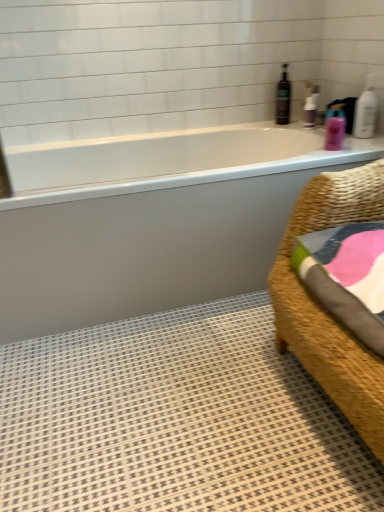
What do you see at coordinates (283, 98) in the screenshot? I see `brown glass bottle at upper right` at bounding box center [283, 98].

What is the approximate height of woven wicker chair at right?

It is 31.91 inches.

What do you see at coordinates (152, 221) in the screenshot? This screenshot has height=512, width=384. I see `white glossy bathtub at upper center` at bounding box center [152, 221].

Locate an element on the screen. The height and width of the screenshot is (512, 384). white glossy bathtub at upper center is located at coordinates (152, 221).

What do you see at coordinates (334, 133) in the screenshot? I see `pink glossy lotion at upper right, the 1th toiletry in the bottom-to-top sequence` at bounding box center [334, 133].

Identify the location of white textured bath mat at lower right. Image resolution: width=384 pixels, height=512 pixels. (176, 420).

Which object is closer to the camera, white glossy bathtub at upper center or woven wicker chair at right?

woven wicker chair at right is more forward.

Considering the positions of points (127, 264) and (271, 276), is point (127, 264) farther from camera compared to point (271, 276)?

Yes, point (127, 264) is behind point (271, 276).

From the image's perspective, is white glossy bathtub at upper center located above woven wicker chair at right?

Correct, white glossy bathtub at upper center appears higher than woven wicker chair at right in the image.

Are white plastic pump at upper right, placed as the 2th toiletry when sorted from bottom to top, and white glossy bathtub at upper center located far from each other?

No, white plastic pump at upper right, placed as the 2th toiletry when sorted from bottom to top, is not far away from white glossy bathtub at upper center.

Does white plastic pump at upper right, acting as the first toiletry starting from the back, come behind white glossy bathtub at upper center?

Yes, it is behind white glossy bathtub at upper center.

Find the location of a particular element. bathtub in front of the white plastic pump at upper right, placed as the 2th toiletry when sorted from bottom to top is located at coordinates (152, 221).

How far apart are white plastic pump at upper right, placed as the 2th toiletry when sorted from bottom to top, and white glossy bathtub at upper center?

white plastic pump at upper right, placed as the 2th toiletry when sorted from bottom to top, and white glossy bathtub at upper center are 35.32 inches apart.

Considering the relative sizes of woven wicker chair at right and white textured bath mat at lower right in the image provided, is woven wicker chair at right wider than white textured bath mat at lower right?

No, woven wicker chair at right is not wider than white textured bath mat at lower right.

Is woven wicker chair at right surrounding white textured bath mat at lower right?

Actually, white textured bath mat at lower right is outside woven wicker chair at right.

Can you tell me how much woven wicker chair at right and white textured bath mat at lower right differ in facing direction?

0.609 degrees separate the facing orientations of woven wicker chair at right and white textured bath mat at lower right.

Considering their positions, is woven wicker chair at right located in front of or behind white textured bath mat at lower right?

woven wicker chair at right is in front of white textured bath mat at lower right.

Is pink glossy lotion at upper right, the 2th toiletry positioned from the top, beside woven wicker chair at right?

No, pink glossy lotion at upper right, the 2th toiletry positioned from the top, is not in contact with woven wicker chair at right.

How far apart are pink glossy lotion at upper right, the first toiletry viewed from the front, and woven wicker chair at right?

pink glossy lotion at upper right, the first toiletry viewed from the front, and woven wicker chair at right are 37.53 inches apart.

The height and width of the screenshot is (512, 384). Identify the location of furniture lying on the left of pink glossy lotion at upper right, marked as the 2th toiletry in a back-to-front arrangement. (323, 307).

From the image's perspective, between pink glossy lotion at upper right, the 1th toiletry in the bottom-to-top sequence, and woven wicker chair at right, which one is located above?

pink glossy lotion at upper right, the 1th toiletry in the bottom-to-top sequence.

Does point (295, 313) come behind point (304, 116)?

No, (295, 313) is closer to viewer.

Can you confirm if woven wicker chair at right is shorter than white plastic pump at upper right, the 1th toiletry positioned from the top?

Incorrect, the height of woven wicker chair at right does not fall short of that of white plastic pump at upper right, the 1th toiletry positioned from the top.

Is woven wicker chair at right turned away from white plastic pump at upper right, acting as the first toiletry starting from the back?

No, woven wicker chair at right is not facing the opposite direction of white plastic pump at upper right, acting as the first toiletry starting from the back.

Can white plastic pump at upper right, acting as the first toiletry starting from the back, be found inside woven wicker chair at right?

That's incorrect, white plastic pump at upper right, acting as the first toiletry starting from the back, is not inside woven wicker chair at right.

How many degrees apart are the facing directions of white textured bath mat at lower right and woven wicker chair at right?

There is a 0.609-degree angle between the facing directions of white textured bath mat at lower right and woven wicker chair at right.

From the image's perspective, is white textured bath mat at lower right positioned above or below woven wicker chair at right?

Clearly, from the image's perspective, white textured bath mat at lower right is below woven wicker chair at right.

The image size is (384, 512). Find the location of `bath mat behind the woven wicker chair at right`. bath mat behind the woven wicker chair at right is located at coordinates (176, 420).

Relative to woven wicker chair at right, is white textured bath mat at lower right in front or behind?

Clearly, white textured bath mat at lower right is behind woven wicker chair at right.

Is pink glossy lotion at upper right, the 1th toiletry in the bottom-to-top sequence, aimed at brown glass bottle at upper right?

No, pink glossy lotion at upper right, the 1th toiletry in the bottom-to-top sequence, is not facing towards brown glass bottle at upper right.

From the image's perspective, is pink glossy lotion at upper right, the 2th toiletry positioned from the top, positioned above or below brown glass bottle at upper right?

Based on their image positions, pink glossy lotion at upper right, the 2th toiletry positioned from the top, is located beneath brown glass bottle at upper right.

Which point is more distant from viewer, (x=326, y=145) or (x=289, y=106)?

Point (x=289, y=106)

You are a GUI agent. You are given a task and a screenshot of the screen. Output one action in this format:
    pyautogui.click(x=<x>, y=<y>)
    Task: Click on the bathtub on the left of woven wicker chair at right
    The height and width of the screenshot is (512, 384).
    Given the screenshot: What is the action you would take?
    tap(152, 221)

Find the location of `the 2nd toiletry above the white glossy bathtub at upper center (from a real-world perspective)`. the 2nd toiletry above the white glossy bathtub at upper center (from a real-world perspective) is located at coordinates (310, 111).

Looking at the image, which one is located further to brown glass bottle at upper right, woven wicker chair at right or white textured bath mat at lower right?

Among the two, white textured bath mat at lower right is located further to brown glass bottle at upper right.

Based on their spatial positions, is white textured bath mat at lower right or woven wicker chair at right closer to brown glass bottle at upper right?

Based on the image, woven wicker chair at right appears to be nearer to brown glass bottle at upper right.

Looking at the image, which one is located closer to brown glass bottle at upper right, white plastic pump at upper right, the 1th toiletry positioned from the top, or white glossy bathtub at upper center?

Among the two, white plastic pump at upper right, the 1th toiletry positioned from the top, is located nearer to brown glass bottle at upper right.

Which object lies further to the anchor point brown glass bottle at upper right, pink glossy lotion at upper right, the first toiletry viewed from the front, or white glossy bathtub at upper center?

Among the two, white glossy bathtub at upper center is located further to brown glass bottle at upper right.

Which object lies further to the anchor point white plastic pump at upper right, acting as the first toiletry starting from the back, woven wicker chair at right or white textured bath mat at lower right?

The object further to white plastic pump at upper right, acting as the first toiletry starting from the back, is white textured bath mat at lower right.

From the image, which object appears to be nearer to woven wicker chair at right, brown glass bottle at upper right or white textured bath mat at lower right?

white textured bath mat at lower right is closer to woven wicker chair at right.

When comparing their distances from white textured bath mat at lower right, does brown glass bottle at upper right or white glossy bathtub at upper center seem closer?

white glossy bathtub at upper center is positioned closer to the anchor white textured bath mat at lower right.

When comparing their distances from brown glass bottle at upper right, does woven wicker chair at right or white plastic pump at upper right, acting as the first toiletry starting from the back, seem closer?

The object closer to brown glass bottle at upper right is white plastic pump at upper right, acting as the first toiletry starting from the back.

Where is `toiletry located between white textured bath mat at lower right and white plastic pump at upper right, the second toiletry when ordered from front to back, in the depth direction`? The height and width of the screenshot is (512, 384). toiletry located between white textured bath mat at lower right and white plastic pump at upper right, the second toiletry when ordered from front to back, in the depth direction is located at coordinates (334, 133).

I want to click on bathtub between white textured bath mat at lower right and brown glass bottle at upper right from front to back, so click(x=152, y=221).

This screenshot has width=384, height=512. Identify the location of bath mat between woven wicker chair at right and white plastic pump at upper right, acting as the first toiletry starting from the back, along the z-axis. (176, 420).

Find the location of `bathtub between white textured bath mat at lower right and white plastic pump at upper right, acting as the first toiletry starting from the back, in the front-back direction`. bathtub between white textured bath mat at lower right and white plastic pump at upper right, acting as the first toiletry starting from the back, in the front-back direction is located at coordinates (152, 221).